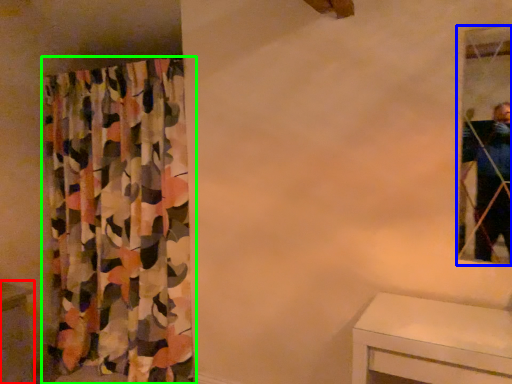
Question: Which object is the farthest from vanity (highlighted by a red box)? Choose among these: mirror (highlighted by a blue box) or curtain (highlighted by a green box).

Choices:
 (A) mirror
 (B) curtain

Answer: (A)